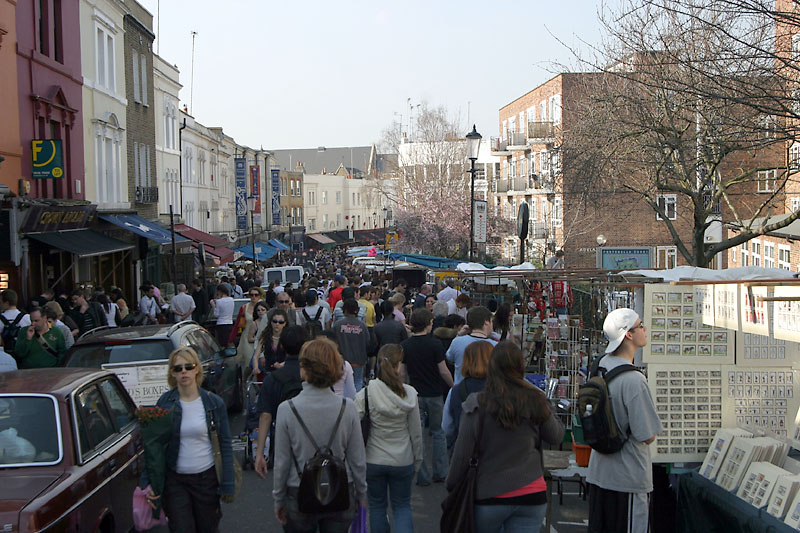
I want to click on pictures, so click(x=780, y=482), click(x=736, y=463), click(x=708, y=414), click(x=702, y=355), click(x=772, y=417), click(x=765, y=345), click(x=710, y=295), click(x=730, y=304), click(x=749, y=310), click(x=780, y=326).